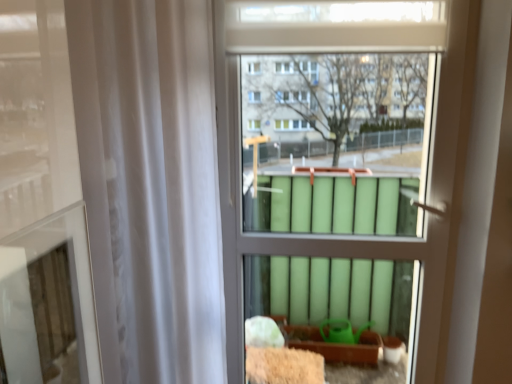
Question: Is point (382, 225) positioned closer to the camera than point (199, 281)?

Choices:
 (A) farther
 (B) closer

Answer: (A)

Question: From a real-world perspective, is green matte radiator at center positioned above or below white sheer curtain at left?

Choices:
 (A) above
 (B) below

Answer: (B)

Question: Looking at their shapes, would you say green matte radiator at center is wider or thinner than white sheer curtain at left?

Choices:
 (A) wide
 (B) thin

Answer: (B)

Question: Is white sheer curtain at left in front of or behind green matte radiator at center in the image?

Choices:
 (A) front
 (B) behind

Answer: (A)

Question: From the image's perspective, relative to green matte radiator at center, is white sheer curtain at left above or below?

Choices:
 (A) above
 (B) below

Answer: (B)

Question: Is point (119, 36) positioned closer to the camera than point (463, 8)?

Choices:
 (A) farther
 (B) closer

Answer: (B)

Question: Is white sheer curtain at left wider or thinner than green matte radiator at center?

Choices:
 (A) thin
 (B) wide

Answer: (B)